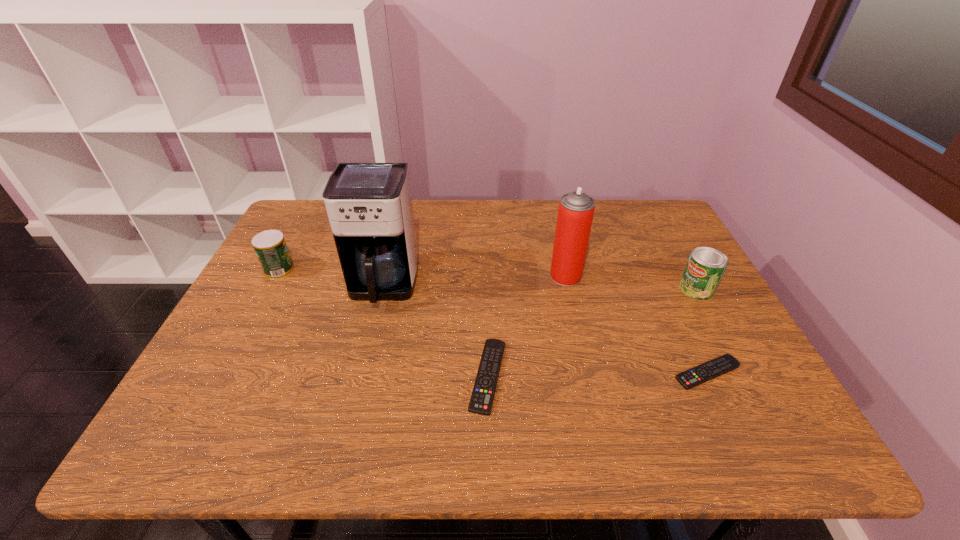
Locate an element on the screen. This screenshot has width=960, height=540. free location at the near edge is located at coordinates click(599, 375).

Where is `free space at the left edge of the desktop`? This screenshot has width=960, height=540. free space at the left edge of the desktop is located at coordinates click(x=296, y=300).

Identify the location of vacant area at the right edge. This screenshot has width=960, height=540. (705, 308).

Locate an element on the screen. vacant region at the far left corner of the desktop is located at coordinates (300, 206).

Find the location of a particular element. vacant point at the far right corner is located at coordinates (632, 208).

At what (x,y) coordinates should I click in order to perform the action: click on blank region between the shortest object and the taller remote control. Please return your answer as a coordinate pair (x, y). Image resolution: width=960 pixels, height=540 pixels. Looking at the image, I should click on (597, 374).

Identify the location of free space between the right can and the shortest object. (702, 330).

Image resolution: width=960 pixels, height=540 pixels. I want to click on free space between the left can and the third object from right to left, so click(422, 273).

Where is `free space that is in between the coffee maker and the right can`? free space that is in between the coffee maker and the right can is located at coordinates (540, 287).

Where is `blank region between the right can and the taller remote control`? The width and height of the screenshot is (960, 540). blank region between the right can and the taller remote control is located at coordinates (592, 332).